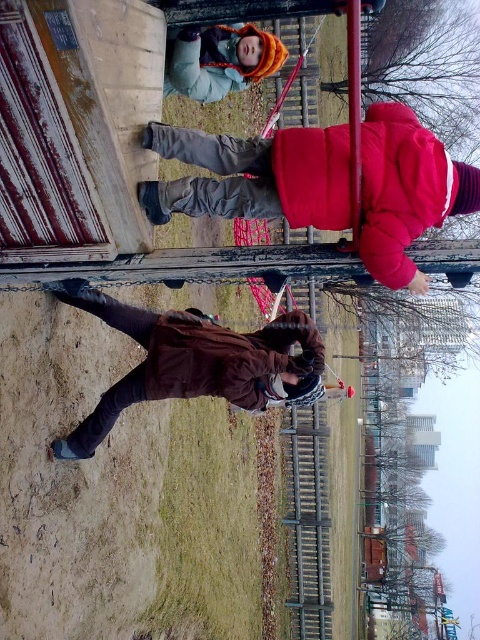
Question: Which object is closer to the camera taking this photo?

Choices:
 (A) brown matte jacket at center
 (B) metallic chain at upper center
 (C) brown matte jacket at lower center

Answer: (B)

Question: From the image, what is the correct spatial relationship of matte red jacket at upper right in relation to orange knit hat at upper center?

Choices:
 (A) left
 (B) right

Answer: (B)

Question: Does orange knit hat at upper center have a greater width compared to metallic chain at upper center?

Choices:
 (A) yes
 (B) no

Answer: (B)

Question: Which point is farther to the camera?

Choices:
 (A) (232, 198)
 (B) (358, 120)
 (C) (173, 380)

Answer: (C)

Question: Can you confirm if matte red jacket at upper right is positioned below brown matte jacket at center?

Choices:
 (A) no
 (B) yes

Answer: (A)

Question: Which point appears closest to the camera in this image?

Choices:
 (A) (87, 288)
 (B) (208, 58)
 (C) (369, 256)
 (D) (349, 173)

Answer: (C)